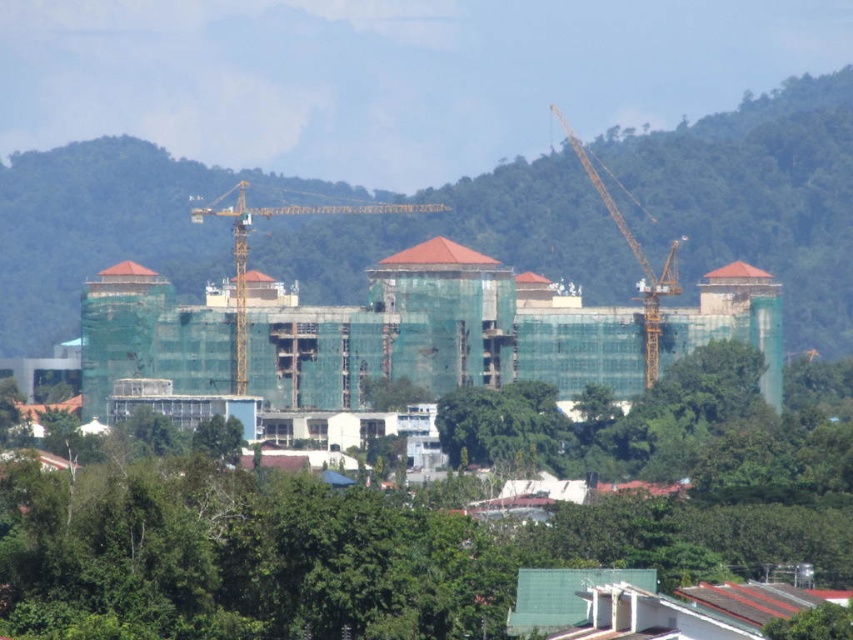
You are an engineer standing at the construction site and need to determine the visibility of two points marked on your blueprint. The points are labeled as point 1 at coordinates point (338, 554) and point 2 at coordinates point (576, 221). Which point is closer to you from your current position at the site?

Point (338, 554) is in front of point (576, 221), so it is closer to you.

You are a construction worker who needs to determine if the yellow metallic crane at center can reach the top of the green netting building at center. Based on their heights, can the crane reach the building?

The green netting building at center is much taller than the yellow metallic crane at center, so the crane cannot reach the top of the building.

You are a construction inspector standing at the entrance of the construction site. You need to locate the green netting building at center. Based on the coordinates provided, can you determine its position relative to the entrance?

The green netting building at center is located at coordinates point (x=756, y=196), which means it is positioned to the right and slightly above the entrance from the inspector perspective.